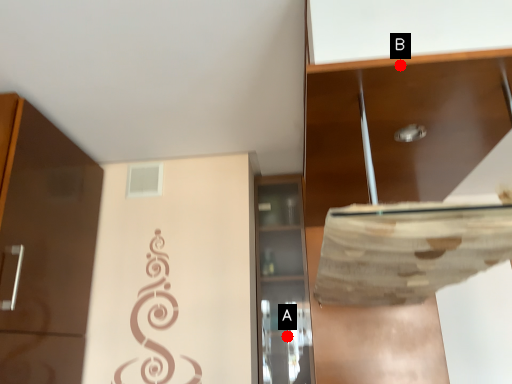
Question: Two points are circled on the image, labeled by A and B beside each circle. Which point appears farthest from the camera in this image?

Choices:
 (A) A is further
 (B) B is further

Answer: (A)